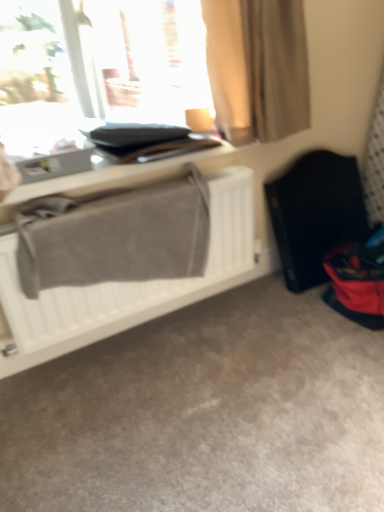
Question: From a real-world perspective, relative to black fabric folding chair at right, is gray fabric at left vertically above or below?

Choices:
 (A) above
 (B) below

Answer: (A)

Question: Is gray fabric at left situated inside black fabric folding chair at right or outside?

Choices:
 (A) outside
 (B) inside

Answer: (A)

Question: Considering the real-world distances, which object is farthest from the beige fabric curtain at upper center?

Choices:
 (A) gray fabric at left
 (B) black fabric folding chair at right
 (C) transparent glass window at upper left
 (D) matte gray table at upper left

Answer: (B)

Question: Estimate the real-world distances between objects in this image. Which object is farther from the matte gray table at upper left?

Choices:
 (A) black fabric folding chair at right
 (B) transparent glass window at upper left
 (C) gray fabric at left
 (D) beige fabric curtain at upper center

Answer: (A)